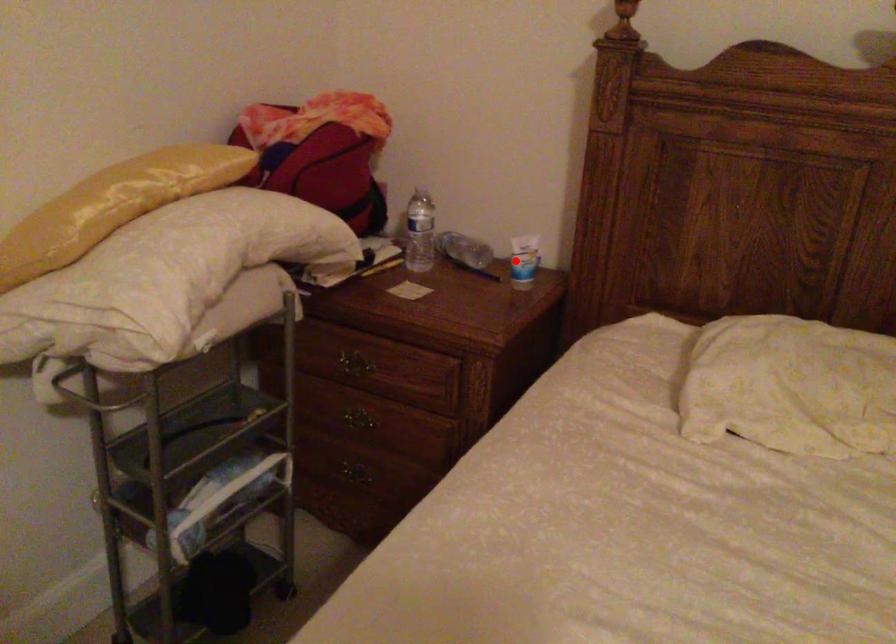
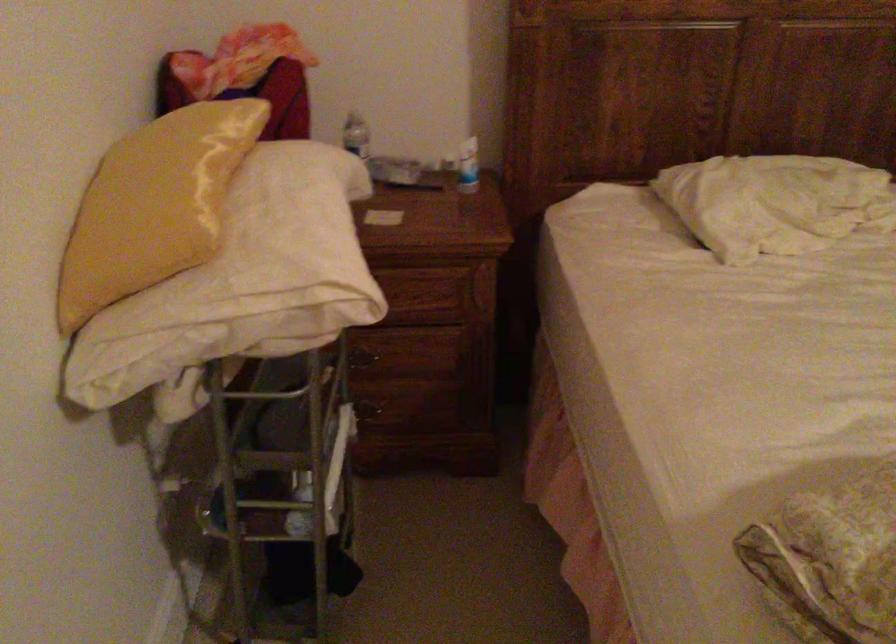
Find the pixel in the second image that matches the highlighted location in the first image.

(468, 166)